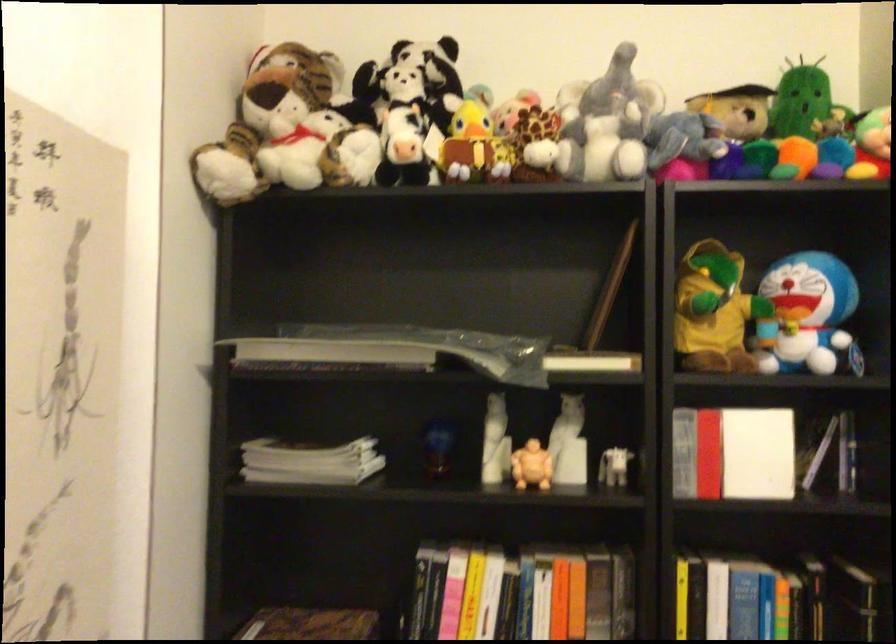
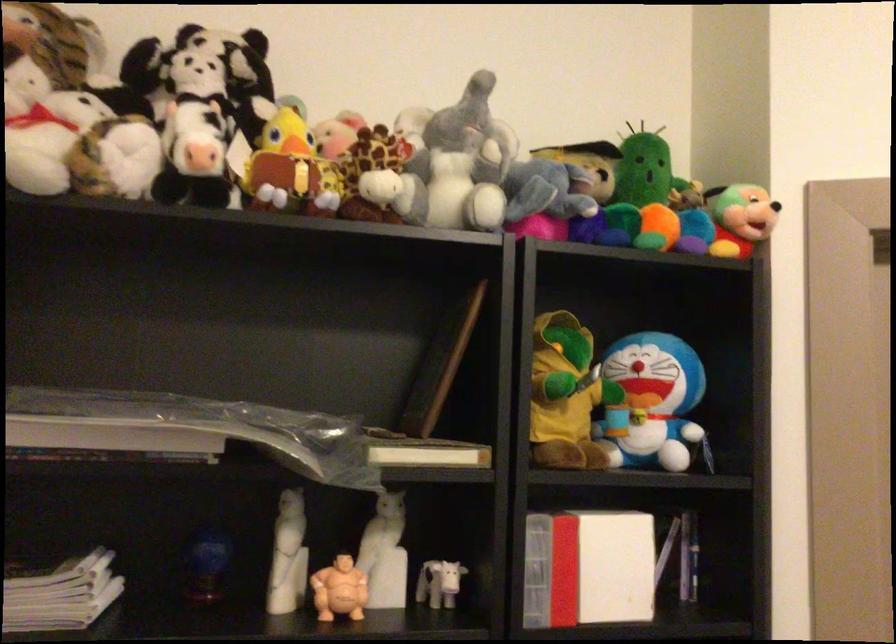
Question: I am providing you with two images of the same scene from different viewpoints. Which of the following objects are not visible in image2?

Choices:
 (A) red and white book
 (B) green frog toy
 (C) stuffed elephant toy
 (D) none of these

Answer: (D)